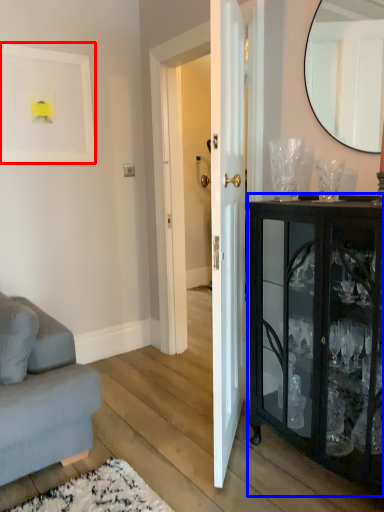
Question: Which object appears farthest to the camera in this image, picture frame (highlighted by a red box) or cabinetry (highlighted by a blue box)?

Choices:
 (A) picture frame
 (B) cabinetry

Answer: (A)